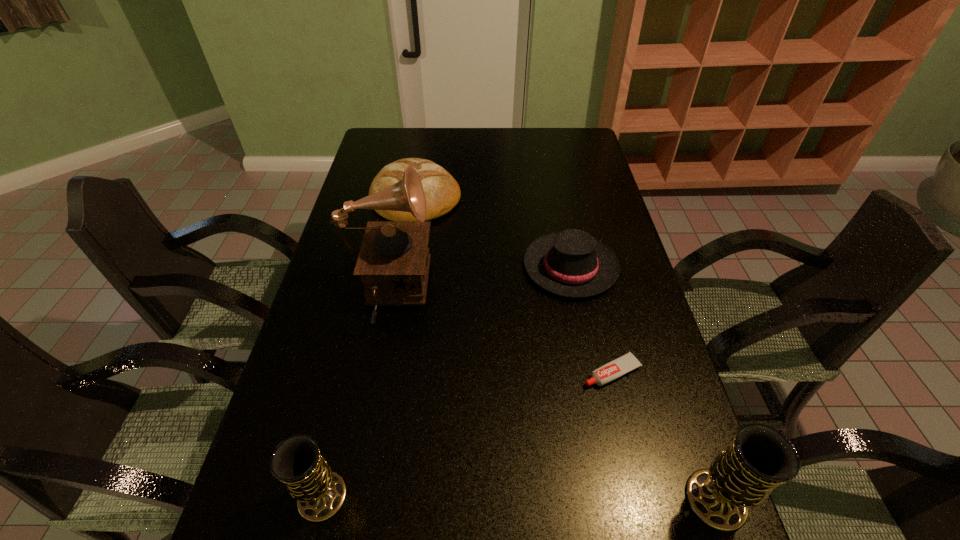
Find the location of a particular element. The image size is (960, 540). free point that satisfies the following two spatial constraints: 1. on the horn of the toothpaste; 2. on the left side of the record player is located at coordinates (372, 372).